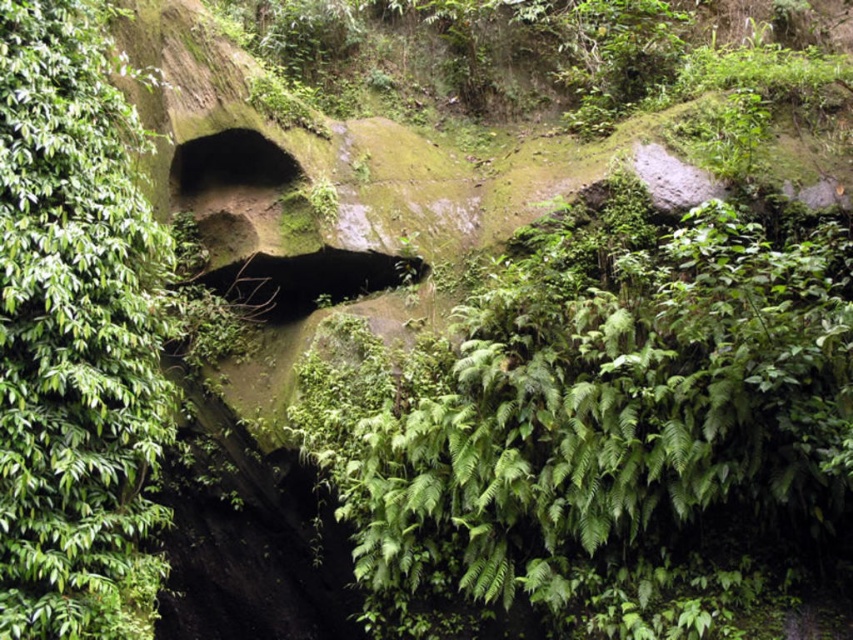
Question: Is green leafy ferns at center positioned behind green leafy tree at left?

Choices:
 (A) no
 (B) yes

Answer: (B)

Question: Does green leafy ferns at center have a lesser width compared to green leafy tree at left?

Choices:
 (A) no
 (B) yes

Answer: (A)

Question: Is green leafy ferns at center to the right of green leafy tree at left from the viewer's perspective?

Choices:
 (A) yes
 (B) no

Answer: (A)